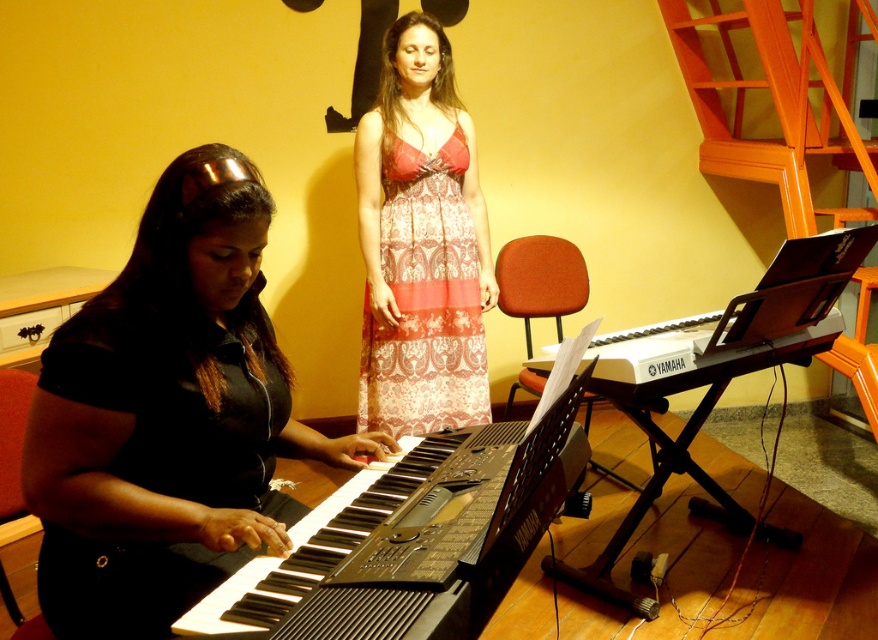
Describe the element at coordinates (167, 416) in the screenshot. I see `black matte shirt at center` at that location.

Does black matte shirt at center have a greater height compared to black plastic keyboard at lower left?

Indeed, black matte shirt at center has a greater height compared to black plastic keyboard at lower left.

Who is more forward, (67, 586) or (443, 456)?

Positioned in front is point (67, 586).

Identify the location of black matte shirt at center. This screenshot has height=640, width=878. (167, 416).

Does patterned fabric dress at center appear under black plastic keyboard at right?

Incorrect, patterned fabric dress at center is not positioned below black plastic keyboard at right.

This screenshot has height=640, width=878. I want to click on patterned fabric dress at center, so click(422, 294).

Who is lower down, black plastic keyboard at lower left or black plastic keyboard at right?

black plastic keyboard at lower left is lower down.

Can you confirm if black plastic keyboard at lower left is wider than black plastic keyboard at right?

No, black plastic keyboard at lower left is not wider than black plastic keyboard at right.

Where is `black plastic keyboard at lower left`? This screenshot has height=640, width=878. black plastic keyboard at lower left is located at coordinates pos(318,540).